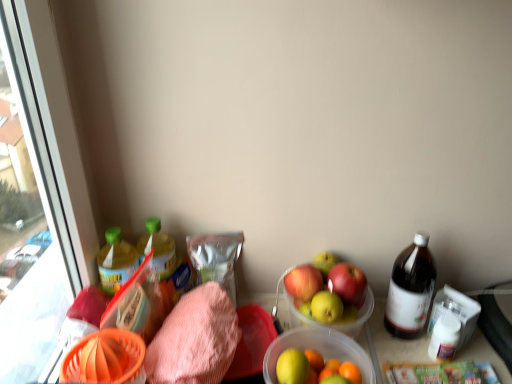
The width and height of the screenshot is (512, 384). What do you see at coordinates (318, 349) in the screenshot?
I see `translucent plastic bowl at center` at bounding box center [318, 349].

Find the location of a particular element. The height and width of the screenshot is (384, 512). green plastic bottle at left, positioned as the first bottle in left-to-right order is located at coordinates (116, 261).

The width and height of the screenshot is (512, 384). Find the location of `pink terry cloth towel at lower left`. pink terry cloth towel at lower left is located at coordinates click(195, 339).

The image size is (512, 384). Find the location of `green plastic bottle at left, the 2th bottle positioned from the right`. green plastic bottle at left, the 2th bottle positioned from the right is located at coordinates (158, 248).

This screenshot has width=512, height=384. Describe the element at coordinates (158, 248) in the screenshot. I see `green plastic bottle at left, the 2th bottle positioned from the right` at that location.

Find the location of a particular element. The height and width of the screenshot is (384, 512). translucent plastic bowl at center is located at coordinates (318, 349).

What's the angular difference between green plastic bottle at left, the 2th bottle positioned from the right, and green plastic bottle at left, the third bottle in the right-to-left sequence,'s facing directions?

The angular difference between green plastic bottle at left, the 2th bottle positioned from the right, and green plastic bottle at left, the third bottle in the right-to-left sequence, is 0.00433 degrees.

Considering the positions of objects green plastic bottle at left, the 2th bottle positioned from the right, and green plastic bottle at left, the third bottle in the right-to-left sequence, in the image provided, who is more to the right, green plastic bottle at left, the 2th bottle positioned from the right, or green plastic bottle at left, the third bottle in the right-to-left sequence,?

green plastic bottle at left, the 2th bottle positioned from the right, is more to the right.

Is green plastic bottle at left, arranged as the 2th bottle when viewed from the left, positioned behind green plastic bottle at left, the third bottle in the right-to-left sequence?

Yes.

From the picture: Who is smaller, green plastic bottle at left, arranged as the 2th bottle when viewed from the left, or green plastic bottle at left, the third bottle in the right-to-left sequence?

Smaller between the two is green plastic bottle at left, the third bottle in the right-to-left sequence.

Is point (265, 357) behind point (158, 250)?

No, it is in front of (158, 250).

Is translucent plastic bowl at center oriented towards green plastic bottle at left, arranged as the 2th bottle when viewed from the left?

No, translucent plastic bowl at center is not facing towards green plastic bottle at left, arranged as the 2th bottle when viewed from the left.

Considering the relative sizes of translucent plastic bowl at center and green plastic bottle at left, arranged as the 2th bottle when viewed from the left, in the image provided, is translucent plastic bowl at center bigger than green plastic bottle at left, arranged as the 2th bottle when viewed from the left,?

Yes, translucent plastic bowl at center is bigger than green plastic bottle at left, arranged as the 2th bottle when viewed from the left.

Find the location of a particular element. Image resolution: width=512 pixels, height=384 pixels. the 2nd bottle located above the translucent plastic bowl at center (from a real-world perspective) is located at coordinates (158, 248).

In the scene shown: Is pink terry cloth towel at lower left looking in the opposite direction of brown glass bottle at right, arranged as the 3th bottle when viewed from the left?

No.

From the image's perspective, would you say pink terry cloth towel at lower left is positioned over brown glass bottle at right, arranged as the 3th bottle when viewed from the left?

No, from the image's perspective, pink terry cloth towel at lower left is not over brown glass bottle at right, arranged as the 3th bottle when viewed from the left.

Can you confirm if pink terry cloth towel at lower left is thinner than brown glass bottle at right, the 1th bottle viewed from the right?

No.

Is point (116, 253) positioned behind point (388, 325)?

No, (116, 253) is closer to viewer.

What's the angular difference between green plastic bottle at left, the third bottle in the right-to-left sequence, and brown glass bottle at right, arranged as the 3th bottle when viewed from the left,'s facing directions?

The angle between the facing direction of green plastic bottle at left, the third bottle in the right-to-left sequence, and the facing direction of brown glass bottle at right, arranged as the 3th bottle when viewed from the left, is 81.4 degrees.

Is green plastic bottle at left, positioned as the first bottle in left-to-right order, next to brown glass bottle at right, the 1th bottle viewed from the right?

green plastic bottle at left, positioned as the first bottle in left-to-right order, and brown glass bottle at right, the 1th bottle viewed from the right, are not in contact.

How many degrees apart are the facing directions of pink terry cloth towel at lower left and green plastic bottle at left, the 2th bottle positioned from the right?

The angle between the facing direction of pink terry cloth towel at lower left and the facing direction of green plastic bottle at left, the 2th bottle positioned from the right, is 0.000415 degrees.

Does pink terry cloth towel at lower left appear on the left side of green plastic bottle at left, the 2th bottle positioned from the right?

In fact, pink terry cloth towel at lower left is to the right of green plastic bottle at left, the 2th bottle positioned from the right.

Could you tell me if pink terry cloth towel at lower left is facing green plastic bottle at left, arranged as the 2th bottle when viewed from the left?

No, pink terry cloth towel at lower left is not aimed at green plastic bottle at left, arranged as the 2th bottle when viewed from the left.

From the image's perspective, is pink terry cloth towel at lower left located above green plastic bottle at left, arranged as the 2th bottle when viewed from the left?

Actually, pink terry cloth towel at lower left appears below green plastic bottle at left, arranged as the 2th bottle when viewed from the left, in the image.

Considering the sizes of translucent plastic bowl at center and green plastic bottle at left, positioned as the first bottle in left-to-right order, in the image, is translucent plastic bowl at center wider or thinner than green plastic bottle at left, positioned as the first bottle in left-to-right order,?

Considering their sizes, translucent plastic bowl at center looks broader than green plastic bottle at left, positioned as the first bottle in left-to-right order.

Who is shorter, translucent plastic bowl at center or green plastic bottle at left, the third bottle in the right-to-left sequence?

Standing shorter between the two is green plastic bottle at left, the third bottle in the right-to-left sequence.

From a real-world perspective, is translucent plastic bowl at center positioned above or below green plastic bottle at left, the third bottle in the right-to-left sequence?

Clearly, from a real-world perspective, translucent plastic bowl at center is below green plastic bottle at left, the third bottle in the right-to-left sequence.

Is green plastic bottle at left, the 2th bottle positioned from the right, oriented towards translucent plastic bowl at center?

No, green plastic bottle at left, the 2th bottle positioned from the right, is not oriented towards translucent plastic bowl at center.

Is green plastic bottle at left, the 2th bottle positioned from the right, to the left of translucent plastic bowl at center from the viewer's perspective?

Indeed, green plastic bottle at left, the 2th bottle positioned from the right, is positioned on the left side of translucent plastic bowl at center.

From their relative heights in the image, would you say green plastic bottle at left, arranged as the 2th bottle when viewed from the left, is taller or shorter than translucent plastic bowl at center?

Clearly, green plastic bottle at left, arranged as the 2th bottle when viewed from the left, is shorter compared to translucent plastic bowl at center.

Does green plastic bottle at left, arranged as the 2th bottle when viewed from the left, come in front of translucent plastic bowl at center?

No, green plastic bottle at left, arranged as the 2th bottle when viewed from the left, is behind translucent plastic bowl at center.

Identify the location of bottle above the green plastic bottle at left, the third bottle in the right-to-left sequence (from the image's perspective). The width and height of the screenshot is (512, 384). (158, 248).

Identify the location of the 1st bottle to the left of the translucent plastic bowl at center, counting from the anchor's position. [158, 248].

From the picture: Considering their positions, is translucent plastic bowl at center positioned closer to green plastic bottle at left, the 2th bottle positioned from the right, than pink terry cloth towel at lower left?

The object closer to green plastic bottle at left, the 2th bottle positioned from the right, is pink terry cloth towel at lower left.

From the image, which object appears to be farther from brown glass bottle at right, the 1th bottle viewed from the right, green plastic bottle at left, arranged as the 2th bottle when viewed from the left, or pink terry cloth towel at lower left?

The object further to brown glass bottle at right, the 1th bottle viewed from the right, is green plastic bottle at left, arranged as the 2th bottle when viewed from the left.

Which object lies nearer to the anchor point brown glass bottle at right, arranged as the 3th bottle when viewed from the left, pink terry cloth towel at lower left or green plastic bottle at left, arranged as the 2th bottle when viewed from the left?

pink terry cloth towel at lower left is positioned closer to the anchor brown glass bottle at right, arranged as the 3th bottle when viewed from the left.

Which object lies further to the anchor point green plastic bottle at left, the third bottle in the right-to-left sequence, brown glass bottle at right, the 1th bottle viewed from the right, or green plastic bottle at left, arranged as the 2th bottle when viewed from the left?

Based on the image, brown glass bottle at right, the 1th bottle viewed from the right, appears to be further to green plastic bottle at left, the third bottle in the right-to-left sequence.

Which object lies nearer to the anchor point brown glass bottle at right, the 1th bottle viewed from the right, green plastic bottle at left, positioned as the first bottle in left-to-right order, or translucent plastic bowl at center?

translucent plastic bowl at center.

Estimate the real-world distances between objects in this image. Which object is closer to translucent plastic bowl at center, pink terry cloth towel at lower left or green plastic bottle at left, the third bottle in the right-to-left sequence?

Among the two, pink terry cloth towel at lower left is located nearer to translucent plastic bowl at center.

From the image, which object appears to be farther from green plastic bottle at left, arranged as the 2th bottle when viewed from the left, pink terry cloth towel at lower left or green plastic bottle at left, the third bottle in the right-to-left sequence?

pink terry cloth towel at lower left is positioned further to the anchor green plastic bottle at left, arranged as the 2th bottle when viewed from the left.

Considering their positions, is translucent plastic bowl at center positioned closer to brown glass bottle at right, arranged as the 3th bottle when viewed from the left, than green plastic bottle at left, the 2th bottle positioned from the right?

The object closer to brown glass bottle at right, arranged as the 3th bottle when viewed from the left, is translucent plastic bowl at center.

Locate an element on the screen. This screenshot has width=512, height=384. bowl between green plastic bottle at left, the third bottle in the right-to-left sequence, and brown glass bottle at right, arranged as the 3th bottle when viewed from the left, in the horizontal direction is located at coordinates (318, 349).

Identify the location of bowl located between green plastic bottle at left, arranged as the 2th bottle when viewed from the left, and brown glass bottle at right, arranged as the 3th bottle when viewed from the left, in the left-right direction. The width and height of the screenshot is (512, 384). (318, 349).

Where is `bowl situated between pink terry cloth towel at lower left and brown glass bottle at right, the 1th bottle viewed from the right, from left to right`? Image resolution: width=512 pixels, height=384 pixels. bowl situated between pink terry cloth towel at lower left and brown glass bottle at right, the 1th bottle viewed from the right, from left to right is located at coordinates (318, 349).

Find the location of a particular element. Image resolution: width=512 pixels, height=384 pixels. waste located between green plastic bottle at left, positioned as the first bottle in left-to-right order, and translucent plastic bowl at center in the left-right direction is located at coordinates (195, 339).